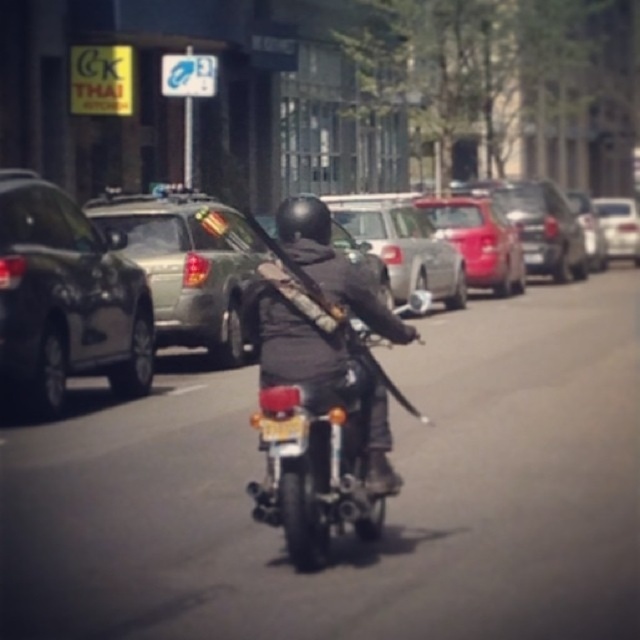
Question: Which of the following is the closest to the observer?

Choices:
 (A) (4, 268)
 (B) (106, 241)
 (C) (321, 397)

Answer: (C)

Question: Does metallic green suv at center-left appear on the left side of shiny chrome motorcycle at center?

Choices:
 (A) yes
 (B) no

Answer: (A)

Question: Does metallic green suv at center-left have a greater width compared to silver metallic sedan at center?

Choices:
 (A) yes
 (B) no

Answer: (B)

Question: Is shiny black suv at left to the left of silver metallic sedan at center from the viewer's perspective?

Choices:
 (A) no
 (B) yes

Answer: (B)

Question: Which is farther from the metallic green suv at center-left?

Choices:
 (A) shiny black suv at left
 (B) silver metallic sedan at center
 (C) shiny chrome motorcycle at center

Answer: (B)

Question: Which of the following is the farthest from the observer?

Choices:
 (A) (3, 224)
 (B) (22, 392)
 (C) (269, 419)
 (D) (394, 280)

Answer: (D)